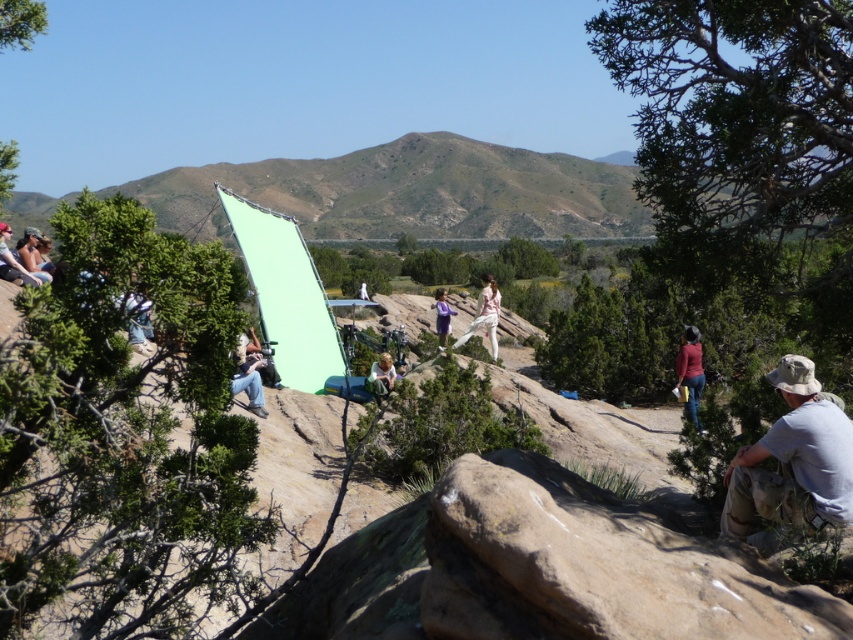
Does gray fabric hat at lower right appear on the right side of denim pants at left?

Indeed, gray fabric hat at lower right is positioned on the right side of denim pants at left.

What are the coordinates of `gray fabric hat at lower right` in the screenshot? It's located at (793, 460).

I want to click on gray fabric hat at lower right, so click(x=793, y=460).

Who is shorter, smooth brown rock at lower right or light brown fabric bag at center?

smooth brown rock at lower right

Can you confirm if smooth brown rock at lower right is wider than light brown fabric bag at center?

Yes.

Where is `smooth brown rock at lower right`? smooth brown rock at lower right is located at coordinates (592, 564).

Image resolution: width=853 pixels, height=640 pixels. Identify the location of smooth brown rock at lower right. (592, 564).

Can you confirm if green fabric tent at center is positioned to the right of matte black jacket at upper left?

No, green fabric tent at center is not to the right of matte black jacket at upper left.

Is green fabric tent at center bigger than matte black jacket at upper left?

Yes, green fabric tent at center is bigger than matte black jacket at upper left.

Between point (274, 193) and point (3, 227), which one is positioned behind?

The point (274, 193) is more distant.

This screenshot has width=853, height=640. I want to click on green fabric tent at center, so click(410, 193).